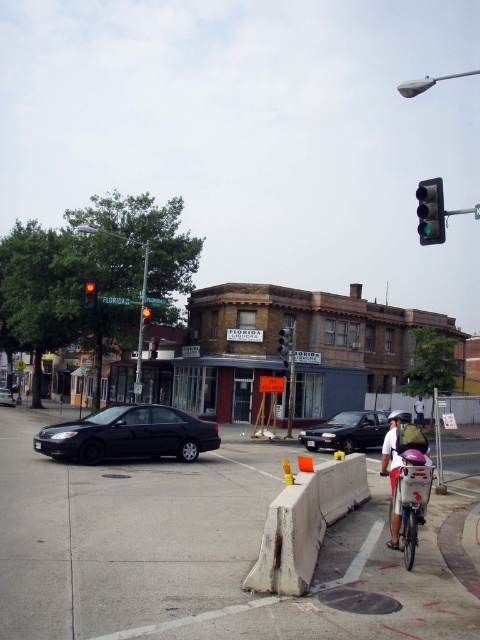
Question: Considering the real-world distances, which object is closest to the light blue shirt at center?

Choices:
 (A) shiny black sedan at center
 (B) orange plastic traffic cone at center
 (C) red glass traffic light at upper left
 (D) green glass traffic light at upper right

Answer: (A)

Question: Which point appears closest to the camera in this image?

Choices:
 (A) (282, 353)
 (B) (87, 448)
 (C) (153, 346)

Answer: (B)

Question: Does red glass traffic light at upper center have a smaller size compared to metallic traffic light at center?

Choices:
 (A) no
 (B) yes

Answer: (B)

Question: Which of the following is the closest to the observer?

Choices:
 (A) orange plastic traffic cone at center
 (B) red glass traffic light at upper left
 (C) shiny black sedan at center

Answer: (A)

Question: Is concrete at center thinner than shiny black sedan at center?

Choices:
 (A) no
 (B) yes

Answer: (B)

Question: Can you confirm if matte black sedan at center is positioned below orange plastic traffic cone at center?

Choices:
 (A) no
 (B) yes

Answer: (A)